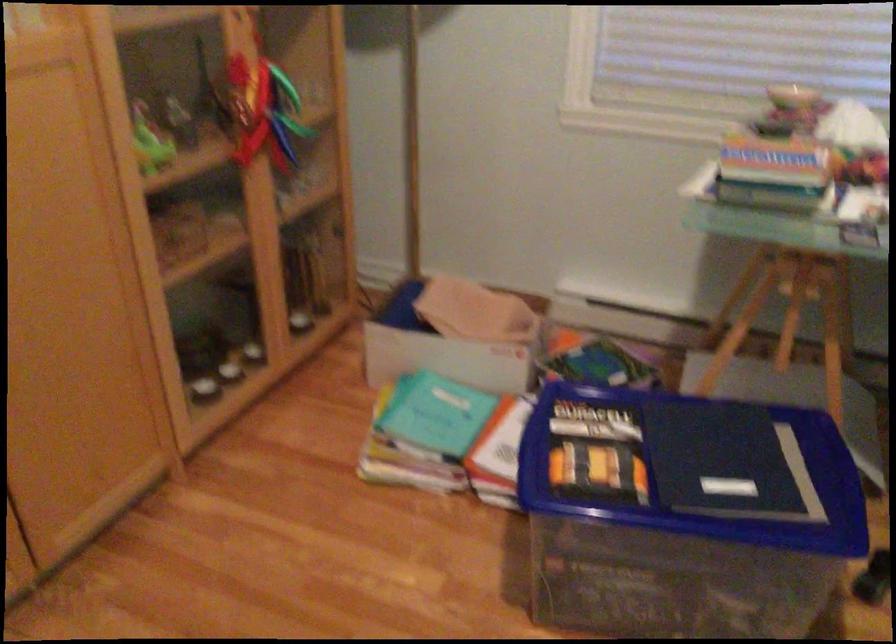
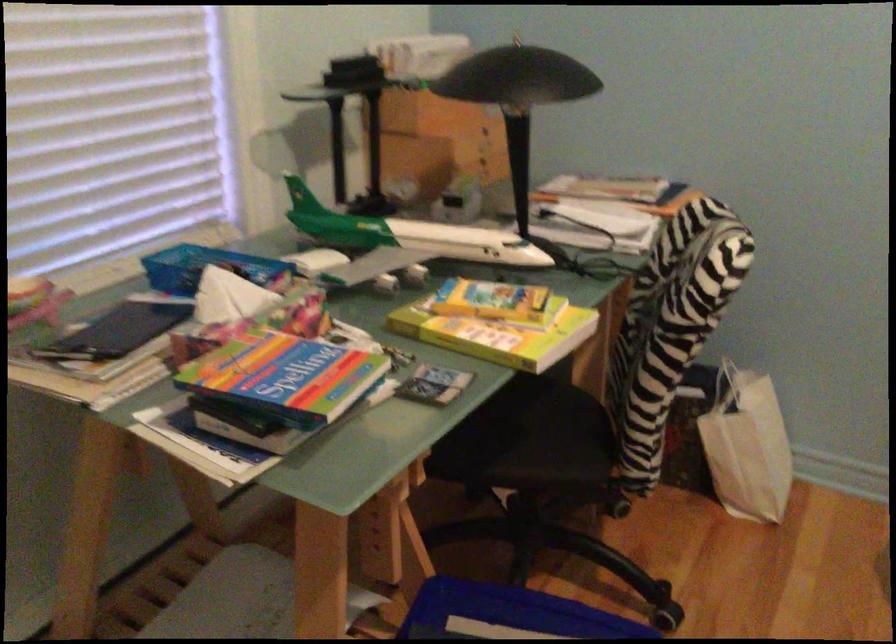
The point at (822, 462) is marked in the first image. Where is the corresponding point in the second image?

(507, 614)